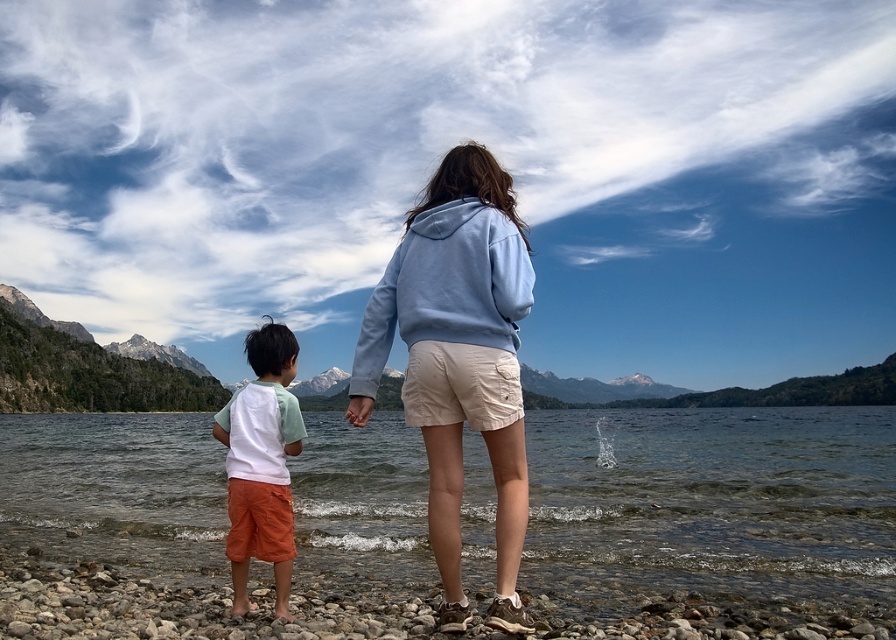
Question: Does light blue hoodie at center lie behind light blue fleece sweatshirt at center?

Choices:
 (A) no
 (B) yes

Answer: (A)

Question: Which object appears closest to the camera in this image?

Choices:
 (A) smooth pebbles at lower center
 (B) light blue hoodie at center
 (C) light blue fleece sweatshirt at center
 (D) white cotton shirt at lower left

Answer: (A)

Question: Which point appears farthest from the camera in this image?

Choices:
 (A) (252, 476)
 (B) (369, 321)

Answer: (B)

Question: Estimate the real-world distances between objects in this image. Which object is closer to the white cotton shirt at lower left?

Choices:
 (A) smooth water at lower center
 (B) light blue hoodie at center
 (C) smooth pebbles at lower center
 (D) light blue fleece sweatshirt at center

Answer: (D)

Question: Observing the image, what is the correct spatial positioning of light blue hoodie at center in reference to white cotton shirt at lower left?

Choices:
 (A) right
 (B) left

Answer: (A)

Question: Does smooth pebbles at lower center appear on the left side of light blue fleece sweatshirt at center?

Choices:
 (A) no
 (B) yes

Answer: (A)